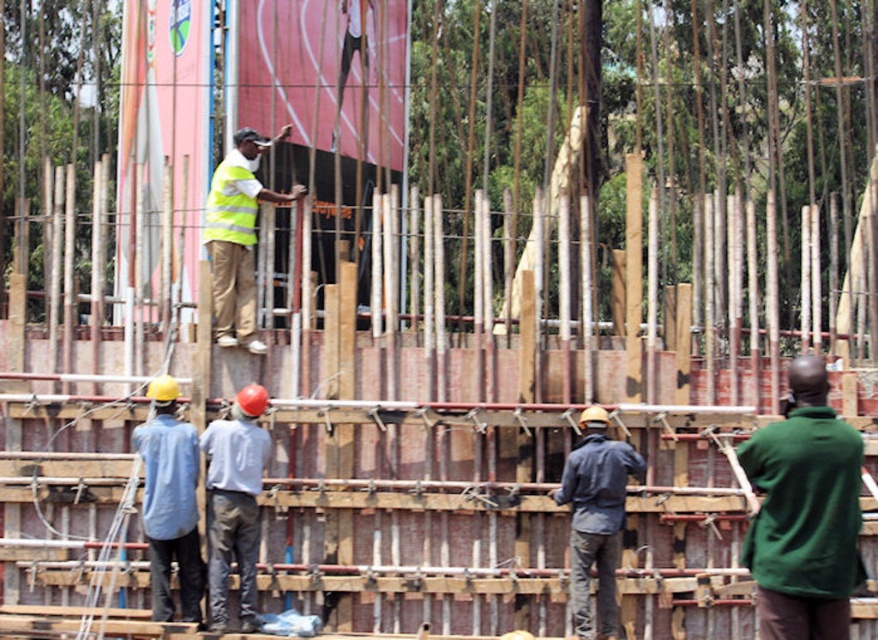
You are a drone operator trying to capture aerial footage of the construction site. You notice two points marked in the image at coordinates point [810,596] and point [254,385]. Which point should you focus on if you want to capture a closer shot without adjusting the drone height?

Point [810,596] is closer to the camera than point [254,385], so focusing on point [810,596] will provide a closer shot without changing the drone height.

You are a safety inspector at the construction site. You notice two workers wearing a light blue shirt at center and a dark blue denim jacket at center. Which worker is positioned to the left side of the other?

The light blue shirt at center is to the left of dark blue denim jacket at center.